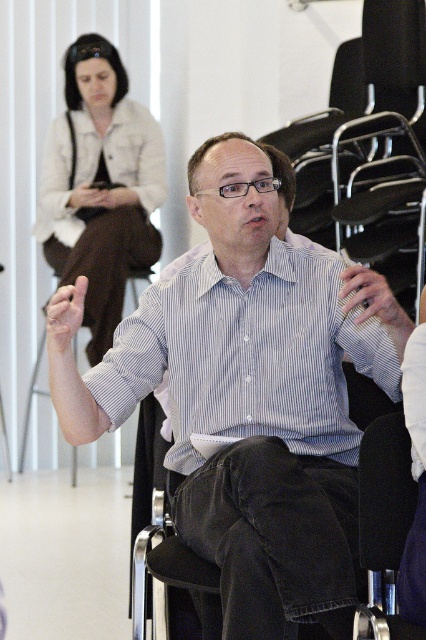
Find the location of a particular element. The height and width of the screenshot is (640, 426). matte white blouse at upper left is located at coordinates (100, 186).

This screenshot has height=640, width=426. Describe the element at coordinates (100, 186) in the screenshot. I see `matte white blouse at upper left` at that location.

Is point (86, 307) more distant than point (63, 349)?

Yes, it is behind point (63, 349).

What are the coordinates of `matte white blouse at upper left` in the screenshot? It's located at (100, 186).

Does blue striped shirt at center come behind matte skin hand at center?

No.

Can you confirm if blue striped shirt at center is positioned to the left of matte skin hand at center?

Incorrect, blue striped shirt at center is not on the left side of matte skin hand at center.

Describe the element at coordinates (250, 396) in the screenshot. I see `blue striped shirt at center` at that location.

Locate an element on the screen. blue striped shirt at center is located at coordinates (250, 396).

Which of these two, blue striped shirt at center or matte white blouse at upper left, stands shorter?

With less height is blue striped shirt at center.

Who is positioned more to the left, blue striped shirt at center or matte white blouse at upper left?

From the viewer's perspective, matte white blouse at upper left appears more on the left side.

Find the location of a particular element. Image resolution: width=426 pixels, height=640 pixels. blue striped shirt at center is located at coordinates (250, 396).

The width and height of the screenshot is (426, 640). In order to click on blue striped shirt at center in this screenshot , I will do `click(250, 396)`.